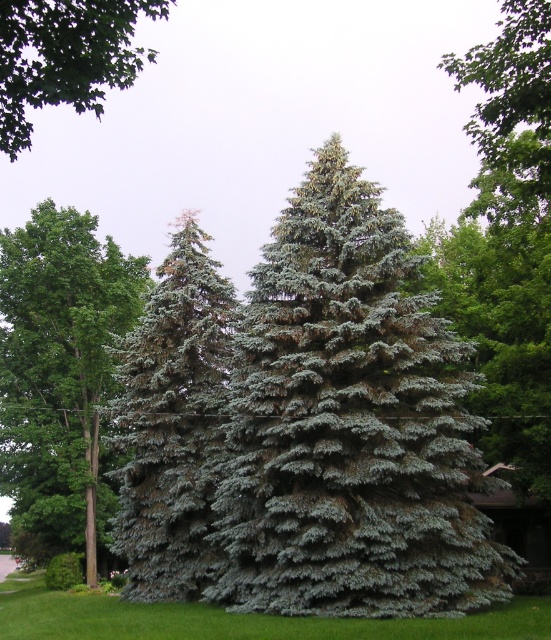
Question: Which point is farther to the camera?

Choices:
 (A) green leafy tree at center
 (B) blue-green needle-like fir tree at center
 (C) blue-green needle-like at center
 (D) green leafy branch at upper left

Answer: (A)

Question: Can you confirm if green leafy tree at center is positioned to the right of green grass at lower center?

Choices:
 (A) no
 (B) yes

Answer: (A)

Question: Observing the image, what is the correct spatial positioning of green grass at lower center in reference to green leafy branch at upper left?

Choices:
 (A) above
 (B) below

Answer: (B)

Question: Estimate the real-world distances between objects in this image. Which object is closer to the blue-green needle-like fir tree at center?

Choices:
 (A) green leafy tree at center
 (B) blue-green needle-like at center
 (C) green leafy branch at upper left
 (D) green grass at lower center

Answer: (B)

Question: Which of the following is the farthest from the observer?

Choices:
 (A) (315, 502)
 (B) (8, 134)
 (C) (143, 564)
 (D) (429, 628)

Answer: (C)

Question: From the image, what is the correct spatial relationship of green leafy tree at center in relation to green leafy branch at upper left?

Choices:
 (A) below
 (B) above

Answer: (A)